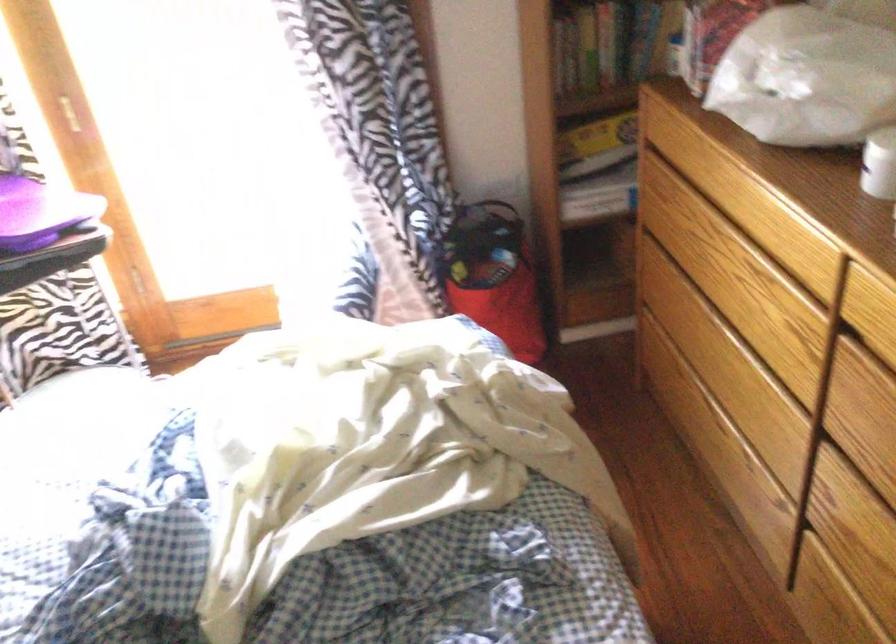
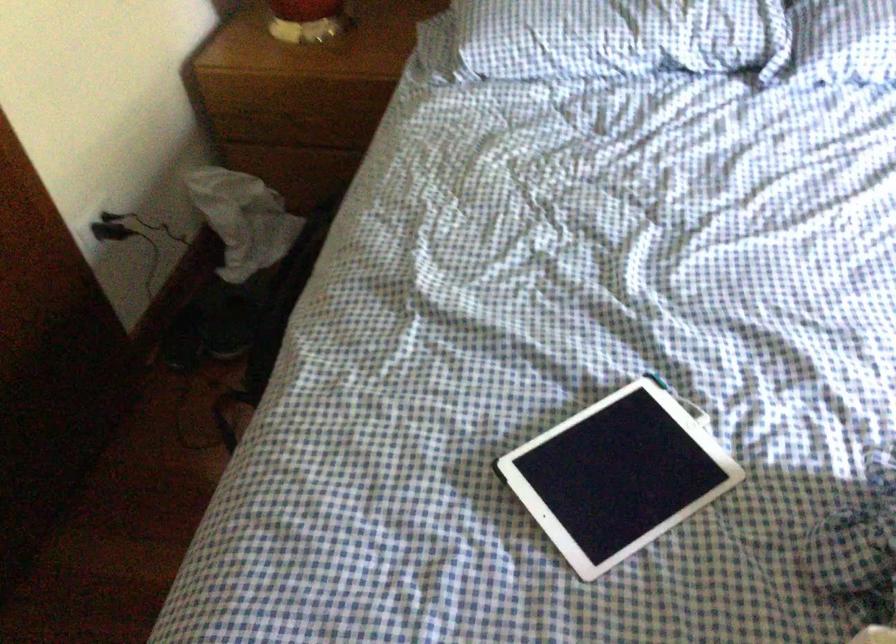
The images are taken continuously from a first-person perspective. In which direction is your viewpoint rotating?

The rotation direction of the camera is left-down.